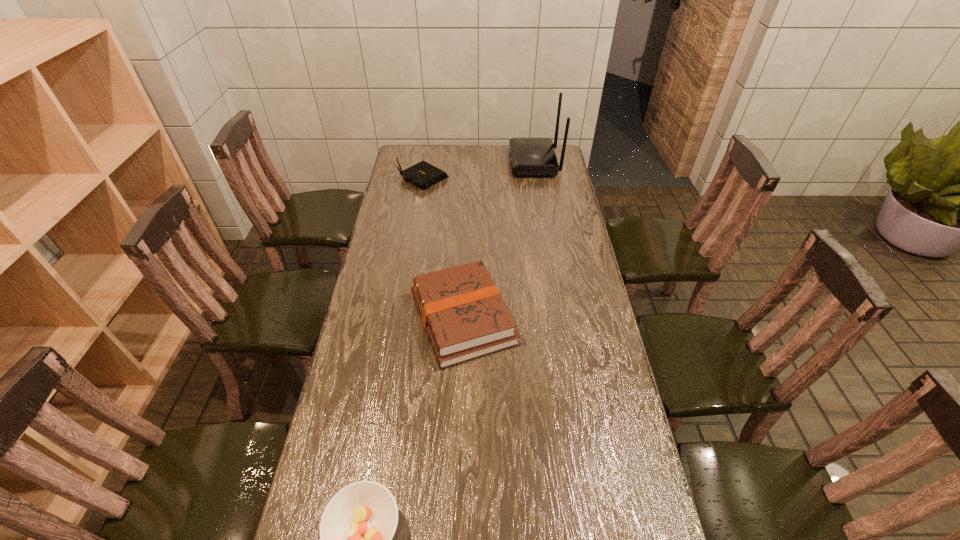
The image size is (960, 540). In order to click on vacant area that lies between the right router and the second nearest object in this screenshot , I will do `click(498, 240)`.

This screenshot has height=540, width=960. What are the coordinates of `free spot between the hardback book and the rightmost object` in the screenshot? It's located at (498, 240).

At what (x,y) coordinates should I click in order to perform the action: click on free space between the left router and the hardback book. Please return your answer as a coordinate pair (x, y). The height and width of the screenshot is (540, 960). Looking at the image, I should click on (443, 248).

Select which object appears as the third closest to the shorter router. Please provide its 2D coordinates. Your answer should be formatted as a tuple, i.e. [(x, y)], where the tuple contains the x and y coordinates of a point satisfying the conditions above.

[(357, 526)]

You are a GUI agent. You are given a task and a screenshot of the screen. Output one action in this format:
    pyautogui.click(x=<x>, y=<y>)
    Task: Click on the object that stands as the closest to the soup bowl
    Image resolution: width=960 pixels, height=540 pixels.
    Given the screenshot: What is the action you would take?
    pyautogui.click(x=462, y=311)

Where is `free region that satisfies the following two spatial constraints: 1. on the front side of the second nearest object; 2. on the left side of the left router`? free region that satisfies the following two spatial constraints: 1. on the front side of the second nearest object; 2. on the left side of the left router is located at coordinates (399, 319).

Where is `free location that satisfies the following two spatial constraints: 1. on the front-facing side of the tallest object; 2. on the front side of the hardback book`? free location that satisfies the following two spatial constraints: 1. on the front-facing side of the tallest object; 2. on the front side of the hardback book is located at coordinates coord(561,319).